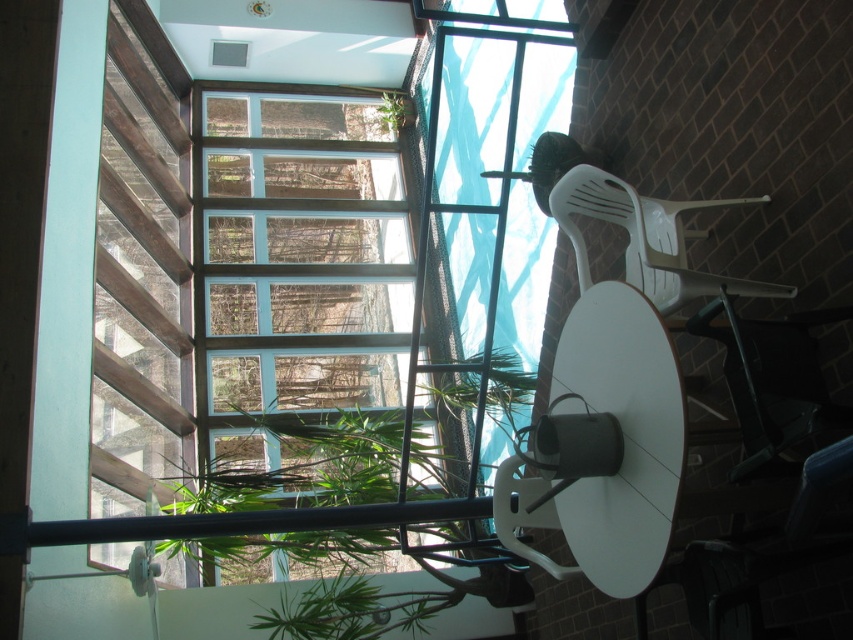
You are sitting at the round white table and looking towards the glass windows. Which object, the wooden slats at left or the green leafy plant at upper center, is closer to you?

The wooden slats at left is closer to you because it is in front of the green leafy plant at upper center.

You are standing in the indoor space and want to see the outdoor trees through the clear glass window at center. Where should you stand to ensure the point at point (296,260) on the window is directly in your line of sight?

You should stand in a position where the point (296,260) on the clear glass window at center is directly in front of you, ensuring that your line of sight passes through this point to view the outdoor trees beyond.

You are sitting at the round white table and want to look at the view outside. Which object, the clear glass window at center or the green leafy plant at upper center, would you look through to see outside?

The clear glass window at center is in front of the green leafy plant at upper center, so you would look through the clear glass window at center to see outside.